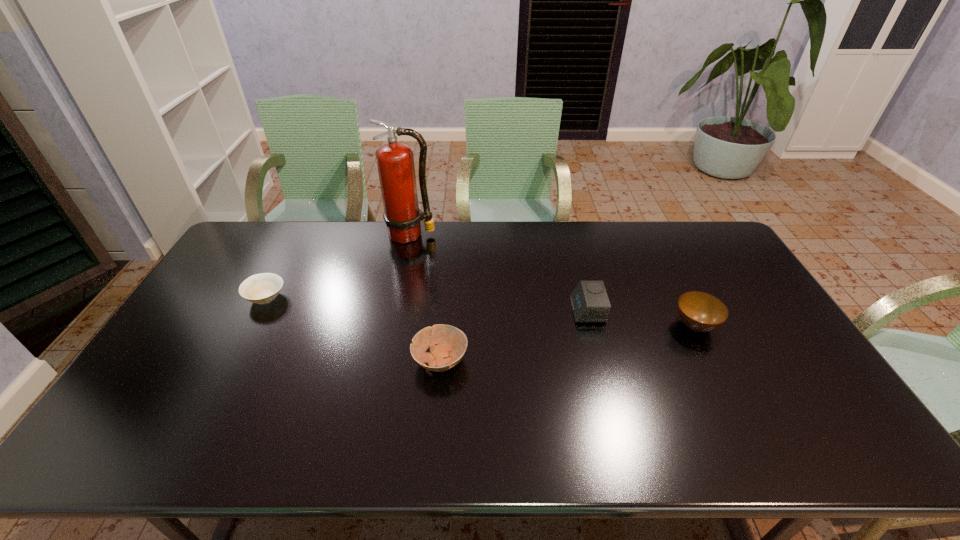
What are the coordinates of `free space at the far left corner` in the screenshot? It's located at (250, 229).

At what (x,y) coordinates should I click in order to perform the action: click on free space at the near right corner. Please return your answer as a coordinate pair (x, y). The height and width of the screenshot is (540, 960). Looking at the image, I should click on click(x=799, y=447).

In order to click on vacant area that lies between the fourth object from left to right and the rightmost object in this screenshot , I will do `click(641, 318)`.

The image size is (960, 540). Identify the location of vacant space that is in between the rightmost bowl and the farthest object. (553, 280).

In order to click on vacant region between the shortest object and the second bowl from left to right in this screenshot , I will do click(x=353, y=329).

This screenshot has height=540, width=960. Find the location of `free space that is in between the farthest object and the rightmost object`. free space that is in between the farthest object and the rightmost object is located at coordinates (553, 280).

The width and height of the screenshot is (960, 540). What are the coordinates of `free space between the second bowl from left to right and the second object from right to left` in the screenshot? It's located at (514, 335).

The width and height of the screenshot is (960, 540). I want to click on free space between the fourth object from left to right and the rightmost bowl, so click(x=641, y=318).

The image size is (960, 540). What are the coordinates of `vacant area that lies between the fourth object from left to right and the leftmost bowl` in the screenshot? It's located at (426, 304).

Find the location of a particular element. This screenshot has width=960, height=540. free space between the second bowl from left to right and the rightmost object is located at coordinates (567, 343).